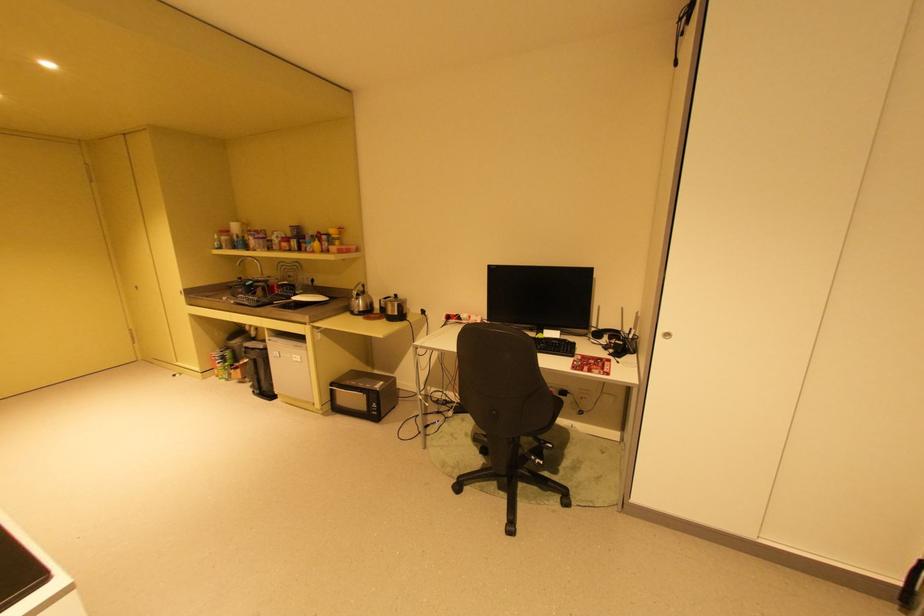
You are a GUI agent. You are given a task and a screenshot of the screen. Output one action in this format:
    pyautogui.click(x=<x>, y=<y>)
    Task: Click on the microwave door handle
    
    Given the screenshot: What is the action you would take?
    [x=363, y=394]